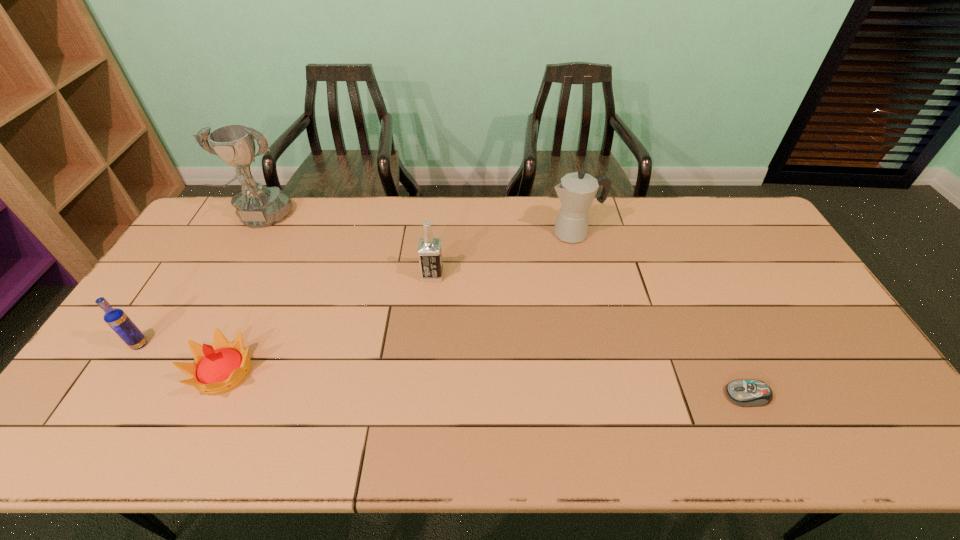
I want to click on award that is positioned at the left edge, so click(257, 206).

What are the coordinates of `vodka situated at the left edge` in the screenshot? It's located at click(x=120, y=323).

Locate an element on the screen. object at the far left corner is located at coordinates (257, 206).

Find the location of a particular element. Image resolution: width=960 pixels, height=540 pixels. vacant space at the far edge is located at coordinates (x=316, y=227).

In the image, there is a desktop. At what (x,y) coordinates should I click in order to perform the action: click on vacant space at the near edge. Please return your answer as a coordinate pair (x, y). Looking at the image, I should click on (306, 434).

The width and height of the screenshot is (960, 540). Identify the location of free location at the left edge. (207, 276).

Identify the location of blank area at the right edge. The height and width of the screenshot is (540, 960). (790, 281).

At what (x,y) coordinates should I click in order to perform the action: click on vacant space at the far right corner of the desktop. Please return your answer as a coordinate pair (x, y). This screenshot has width=960, height=540. Looking at the image, I should click on (763, 238).

Find the location of a particular element. The image size is (960, 540). free space at the near right corner is located at coordinates (852, 431).

At what (x,y) coordinates should I click in order to perform the action: click on free space between the left vodka and the computer mouse. Please return your answer as a coordinate pair (x, y). This screenshot has width=960, height=540. Looking at the image, I should click on (444, 370).